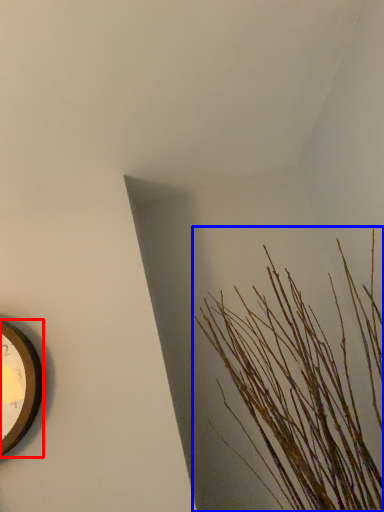
Question: Among these objects, which one is farthest to the camera, wall clock (highlighted by a red box) or houseplant (highlighted by a blue box)?

Choices:
 (A) wall clock
 (B) houseplant

Answer: (A)